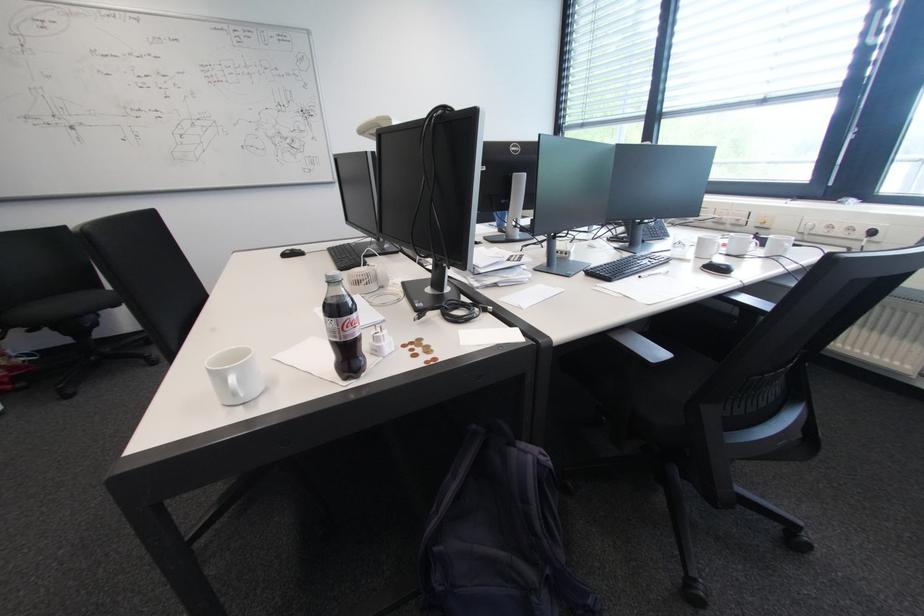
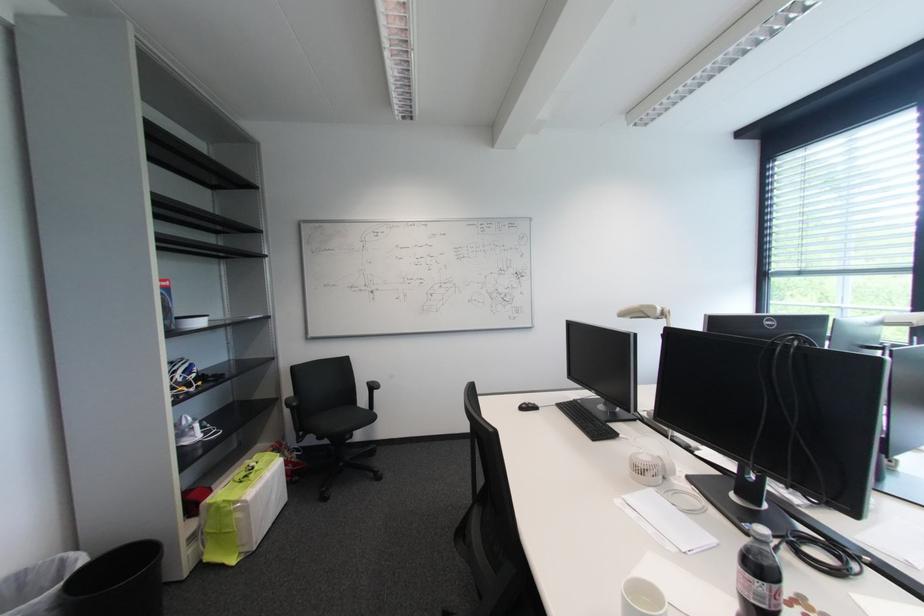
Question: I am providing you with two images of the same scene from different viewpoints. Which of the following objects are not visible in image2?

Choices:
 (A) black chair armrest
 (B) soda bottle
 (C) white box
 (D) none of these

Answer: (D)